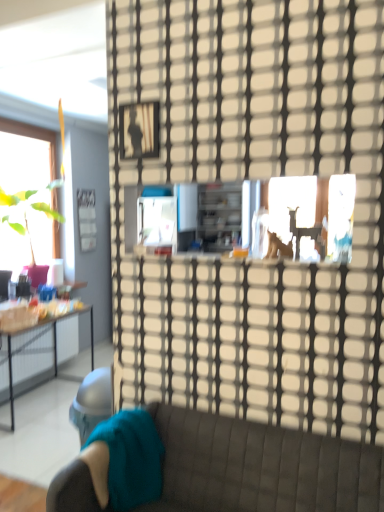
In order to click on free space above teal fabric pillow at lower left (from a real-world perspective) in this screenshot , I will do click(114, 423).